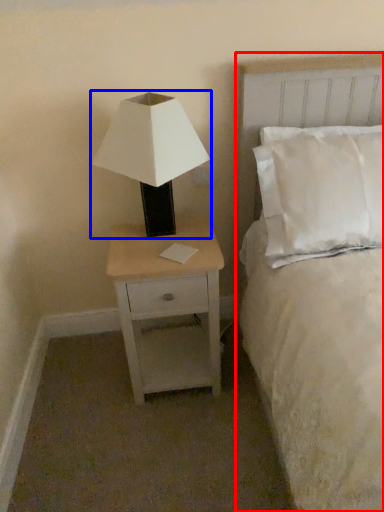
Question: Which of the following is the closest to the observer, bed (highlighted by a red box) or lamp (highlighted by a blue box)?

Choices:
 (A) bed
 (B) lamp

Answer: (A)